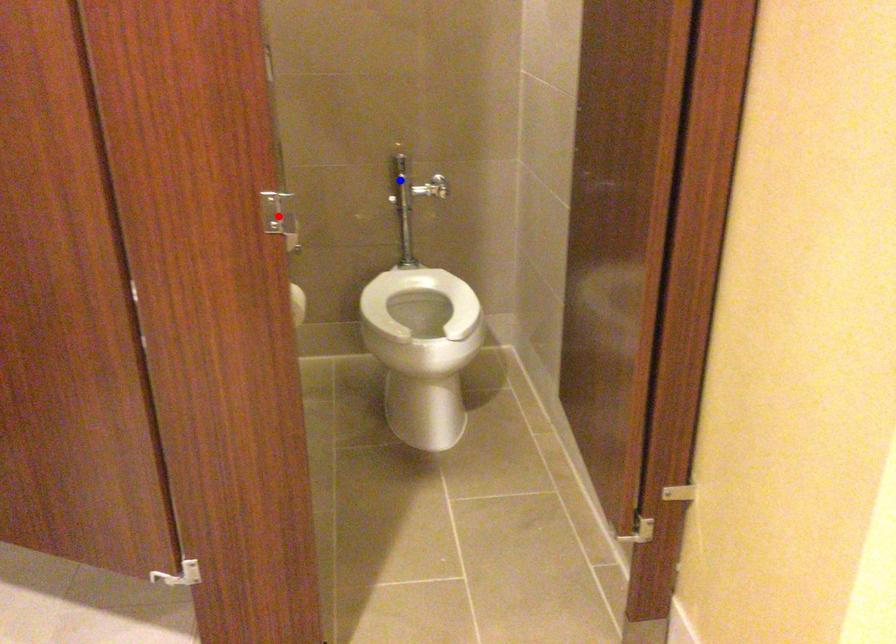
Question: In the image, two points are highlighted. Which point is nearer to the camera? Reply with the corresponding letter.

Choices:
 (A) blue point
 (B) red point

Answer: (B)